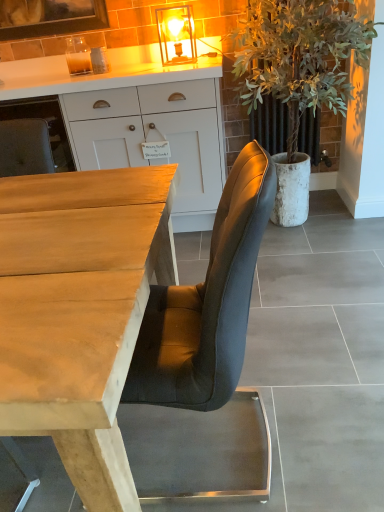
This screenshot has height=512, width=384. I want to click on vacant area on top of wooden desk at center (from a real-world perspective), so click(x=60, y=219).